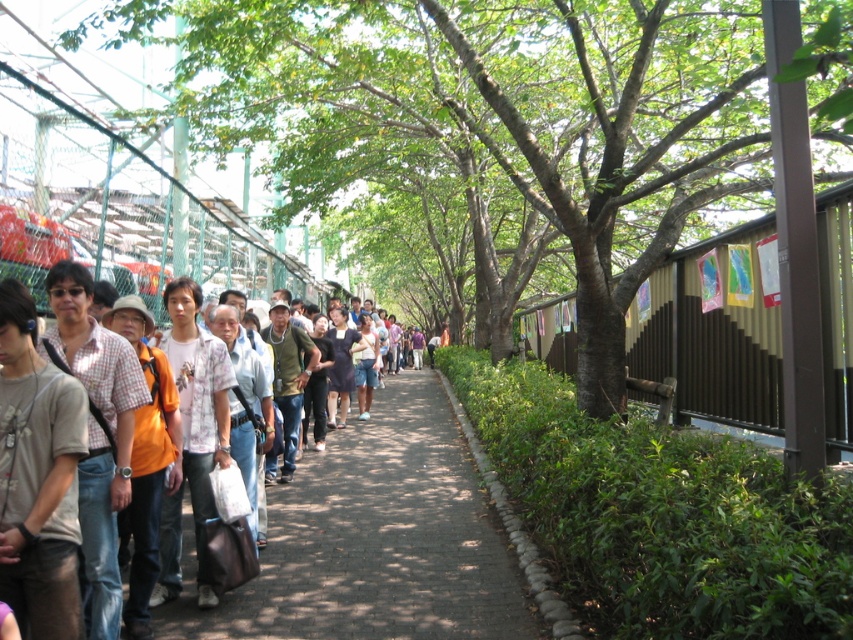
Can you confirm if brick paved sidewalk at center is smaller than matte black shirt at center?

Yes.

Does point (428, 490) come behind point (194, 621)?

Yes, it is behind point (194, 621).

Which is in front, point (374, 481) or point (426, 529)?

Point (426, 529) is in front.

You are a GUI agent. You are given a task and a screenshot of the screen. Output one action in this format:
    pyautogui.click(x=<x>, y=<y>)
    Task: Click on the brick paved sidewalk at center
    This screenshot has width=853, height=640.
    Given the screenshot: What is the action you would take?
    pyautogui.click(x=374, y=540)

Which is below, green leafy tree at center or matte black shirt at center?

matte black shirt at center

What do you see at coordinates (491, 118) in the screenshot?
I see `green leafy tree at center` at bounding box center [491, 118].

In order to click on green leafy tree at center in this screenshot , I will do `click(491, 118)`.

Describe the element at coordinates (491, 118) in the screenshot. The width and height of the screenshot is (853, 640). I see `green leafy tree at center` at that location.

Does point (592, 157) lie in front of point (381, 636)?

No.

Is point (293, 17) farther from viewer compared to point (311, 579)?

That is True.

At what (x,y) coordinates should I click in order to perform the action: click on green leafy tree at center. Please return your answer as a coordinate pair (x, y). This screenshot has height=640, width=853. Looking at the image, I should click on [491, 118].